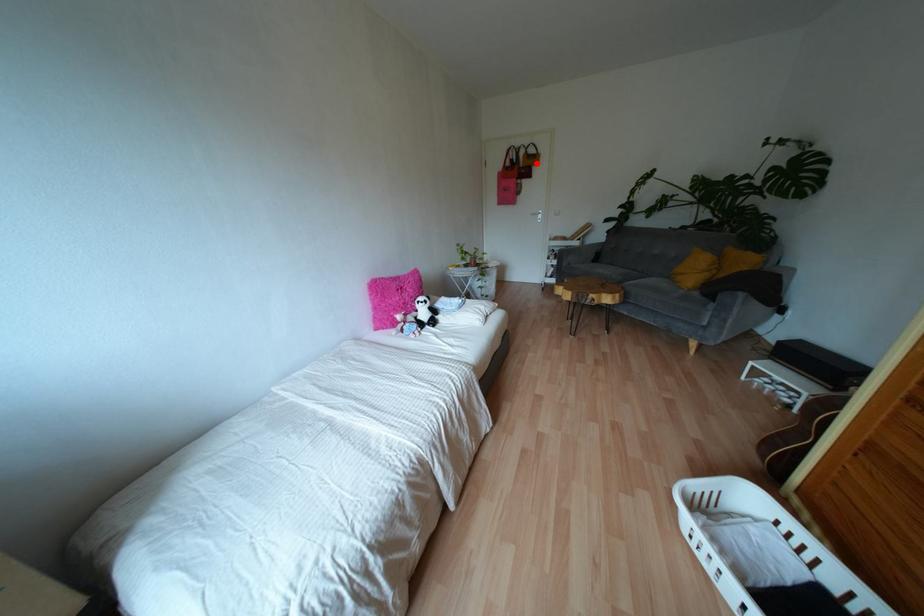
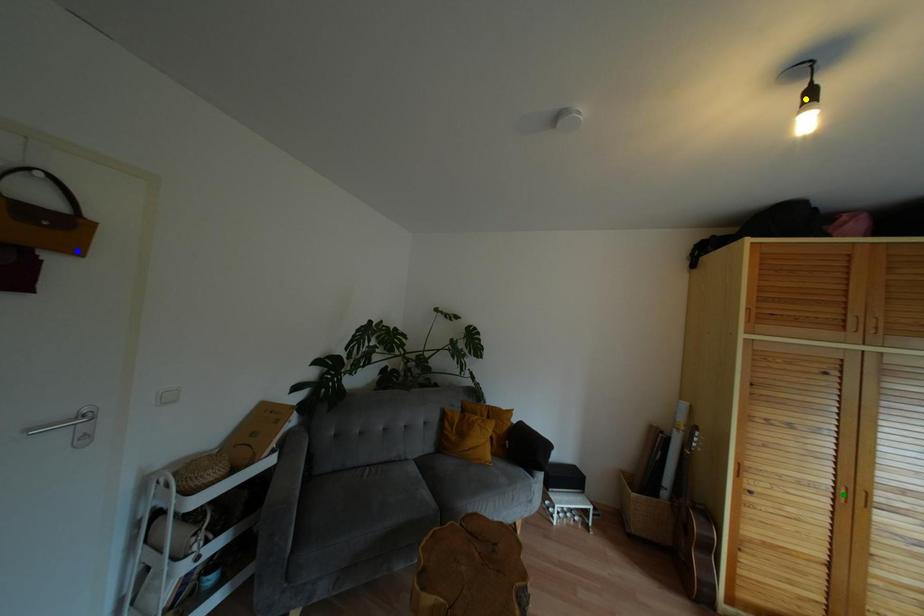
Question: I am providing you with two images of the same scene from different viewpoints. A red point is marked on the first image. You are given multiple points on the second image. Which point in image 2 is actually the same real-world point as the red point in image 1?

Choices:
 (A) green point
 (B) yellow point
 (C) blue point

Answer: (C)